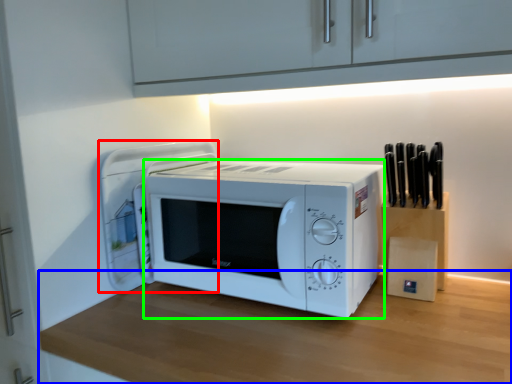
Question: Considering the real-world distances, which object is farthest from appliance (highlighted by a red box)? table (highlighted by a blue box) or microwave oven (highlighted by a green box)?

Choices:
 (A) table
 (B) microwave oven

Answer: (A)